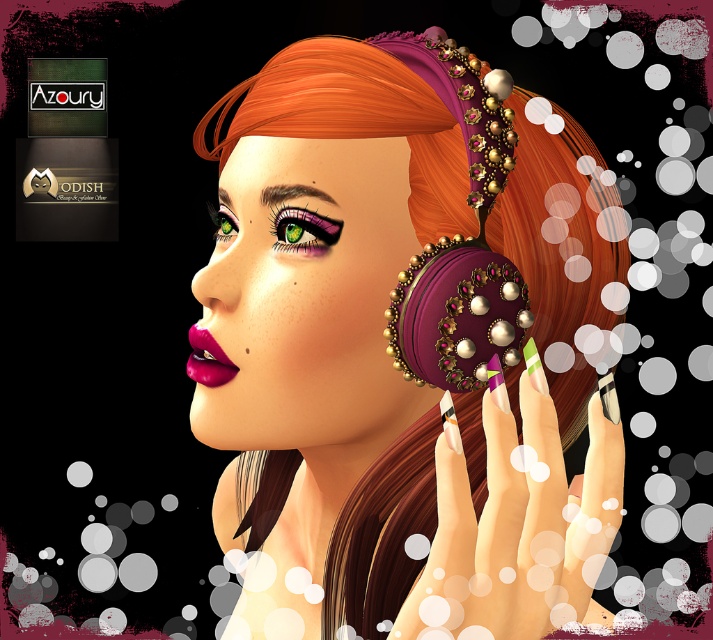
Question: Can you confirm if matte purple earring at center is positioned to the left of matte pink lipstick at lower left?

Choices:
 (A) no
 (B) yes

Answer: (A)

Question: Based on their relative distances, which object is farther from the matte pink lipstick at lower left?

Choices:
 (A) nail polish at center
 (B) matte purple earring at center

Answer: (A)

Question: Is matte purple earring at center above nail polish at center?

Choices:
 (A) no
 (B) yes

Answer: (B)

Question: Can you confirm if matte purple earring at center is positioned to the left of nail polish at center?

Choices:
 (A) yes
 (B) no

Answer: (A)

Question: Which object appears closest to the camera in this image?

Choices:
 (A) nail polish at center
 (B) matte purple earring at center
 (C) matte pink lipstick at lower left

Answer: (A)

Question: Which of the following is the farthest from the observer?

Choices:
 (A) pos(220,362)
 (B) pos(446,113)
 (C) pos(436,451)

Answer: (A)